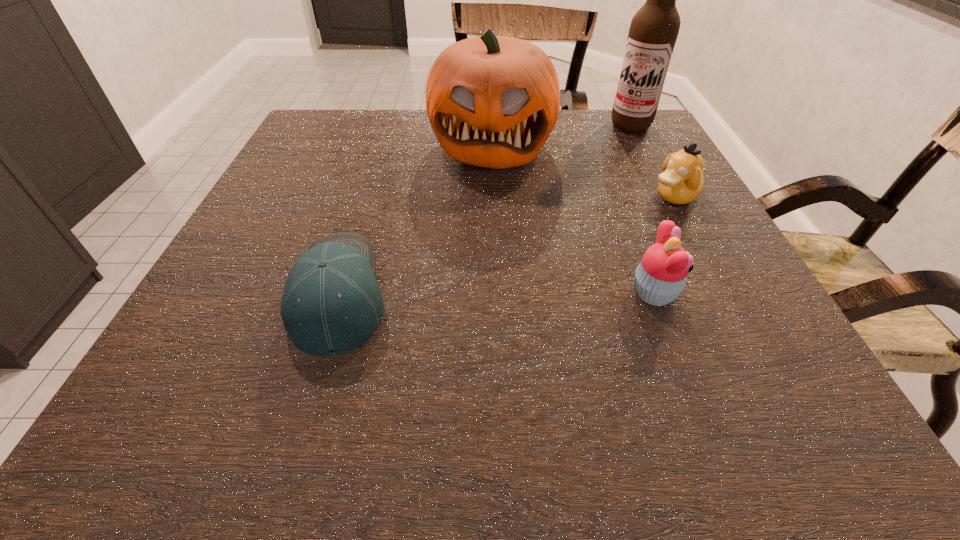
In order to click on cupcake that is at the near edge in this screenshot , I will do `click(660, 277)`.

In order to click on object located at the left edge in this screenshot , I will do `click(331, 303)`.

The height and width of the screenshot is (540, 960). I want to click on cupcake that is at the right edge, so click(x=660, y=277).

Find the location of a particular element. The image size is (960, 540). alcohol that is at the right edge is located at coordinates (653, 32).

You are a GUI agent. You are given a task and a screenshot of the screen. Output one action in this format:
    pyautogui.click(x=<x>, y=<y>)
    Task: Click on the duckling at the right edge
    
    Given the screenshot: What is the action you would take?
    tap(682, 181)

Locate an element on the screen. object at the near left corner is located at coordinates (331, 303).

Where is `object that is at the far right corner`? The image size is (960, 540). object that is at the far right corner is located at coordinates click(x=653, y=32).

Identify the location of object that is at the near right corner. 660,277.

Locate an element on the screen. vacant space at the far edge is located at coordinates (385, 140).

This screenshot has height=540, width=960. In the image, there is a desktop. What are the coordinates of `vacant space at the near edge` in the screenshot? It's located at (427, 338).